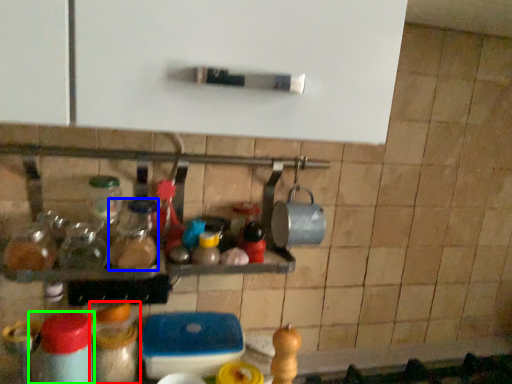
Question: Considering the real-world distances, which object is farthest from bottle (highlighted by a red box)? bottle (highlighted by a blue box) or bottle (highlighted by a green box)?

Choices:
 (A) bottle
 (B) bottle

Answer: (A)